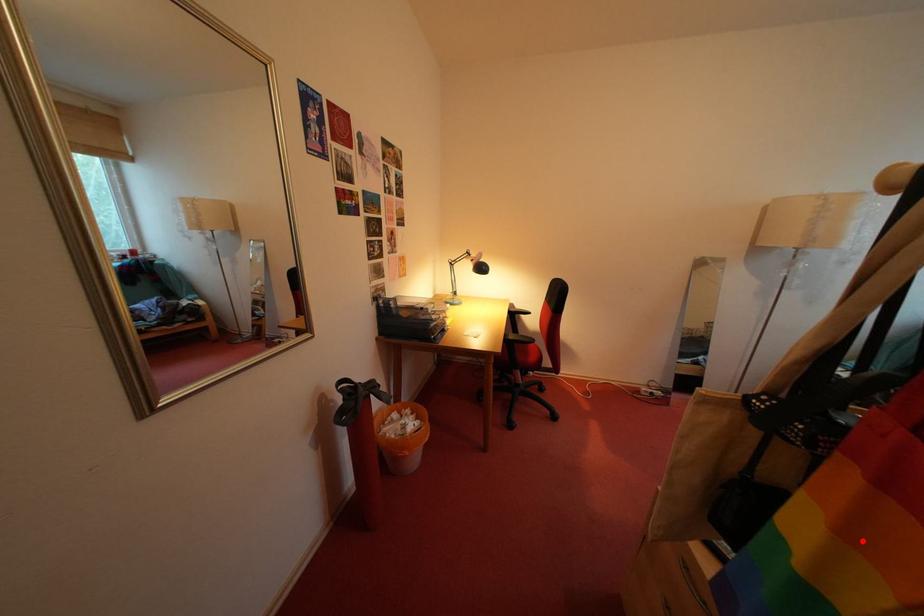
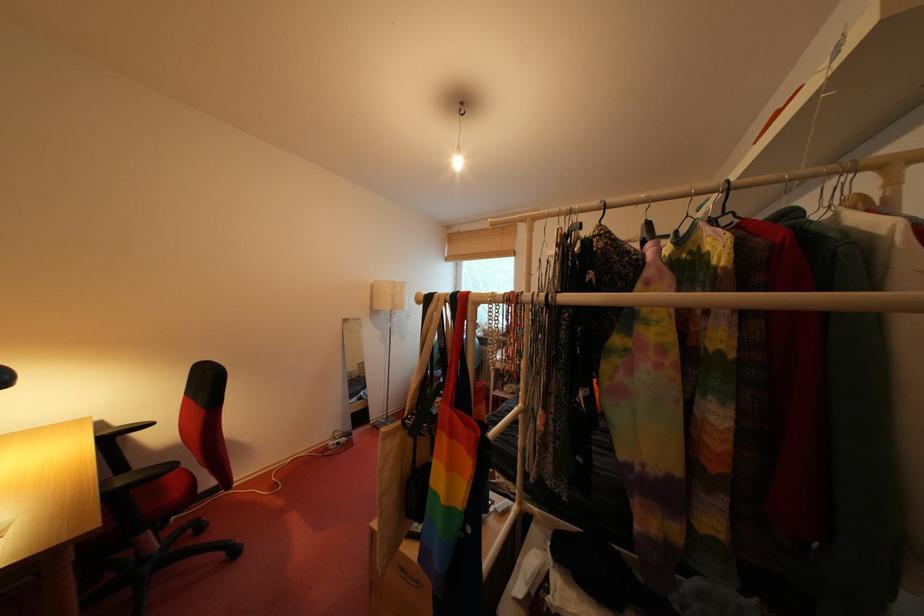
Question: I am providing you with two images of the same scene from different viewpoints. Image1 has a red point marked. In image2, the corresponding 3D location appears at what relative position? Reply with the corresponding letter.

Choices:
 (A) Closer
 (B) Farther

Answer: (B)